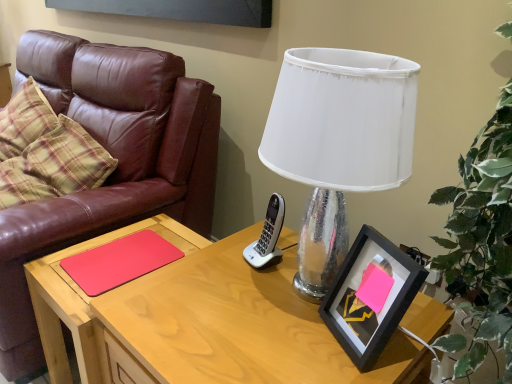
Question: Is white fabric lampshade at upper center at the left side of black matte picture frame at right?

Choices:
 (A) no
 (B) yes

Answer: (B)

Question: Does white fabric lampshade at upper center have a smaller size compared to black matte picture frame at right?

Choices:
 (A) yes
 (B) no

Answer: (B)

Question: Is white fabric lampshade at upper center positioned in front of black matte picture frame at right?

Choices:
 (A) no
 (B) yes

Answer: (B)

Question: Considering the relative sizes of white fabric lampshade at upper center and black matte picture frame at right in the image provided, is white fabric lampshade at upper center taller than black matte picture frame at right?

Choices:
 (A) yes
 (B) no

Answer: (A)

Question: From a real-world perspective, is white fabric lampshade at upper center located higher than black matte picture frame at right?

Choices:
 (A) no
 (B) yes

Answer: (B)

Question: Considering their positions, is black matte picture frame at right located in front of or behind wooden desk at center?

Choices:
 (A) behind
 (B) front

Answer: (A)

Question: In terms of height, does black matte picture frame at right look taller or shorter compared to wooden desk at center?

Choices:
 (A) tall
 (B) short

Answer: (B)

Question: Based on their sizes in the image, would you say black matte picture frame at right is bigger or smaller than wooden desk at center?

Choices:
 (A) big
 (B) small

Answer: (B)

Question: In the image, is black matte picture frame at right on the left side or the right side of wooden desk at center?

Choices:
 (A) right
 (B) left

Answer: (A)

Question: From a real-world perspective, is red matte wood side table at left positioned above or below black matte picture frame at right?

Choices:
 (A) below
 (B) above

Answer: (A)

Question: Considering the relative positions of red matte wood side table at left and black matte picture frame at right in the image provided, is red matte wood side table at left to the left or to the right of black matte picture frame at right?

Choices:
 (A) left
 (B) right

Answer: (A)

Question: Does point (84, 382) appear closer or farther from the camera than point (365, 263)?

Choices:
 (A) farther
 (B) closer

Answer: (A)

Question: In terms of width, does red matte wood side table at left look wider or thinner when compared to black matte picture frame at right?

Choices:
 (A) wide
 (B) thin

Answer: (A)

Question: From the image's perspective, is red matte wood side table at left located above or below matte pink notepad at center?

Choices:
 (A) below
 (B) above

Answer: (A)

Question: Is red matte wood side table at left spatially inside matte pink notepad at center, or outside of it?

Choices:
 (A) outside
 (B) inside

Answer: (A)